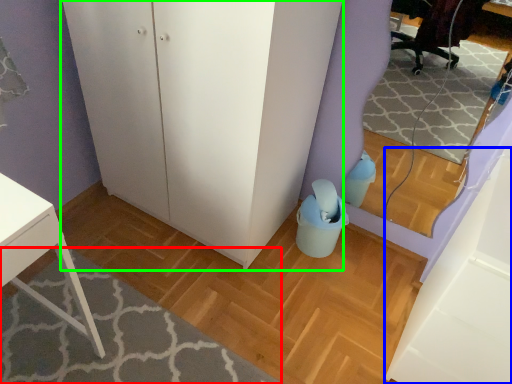
Question: Based on their relative distances, which object is nearer to plain (highlighted by a red box)? Choose from cabinetry (highlighted by a blue box) and dresser (highlighted by a green box).

Choices:
 (A) cabinetry
 (B) dresser

Answer: (B)